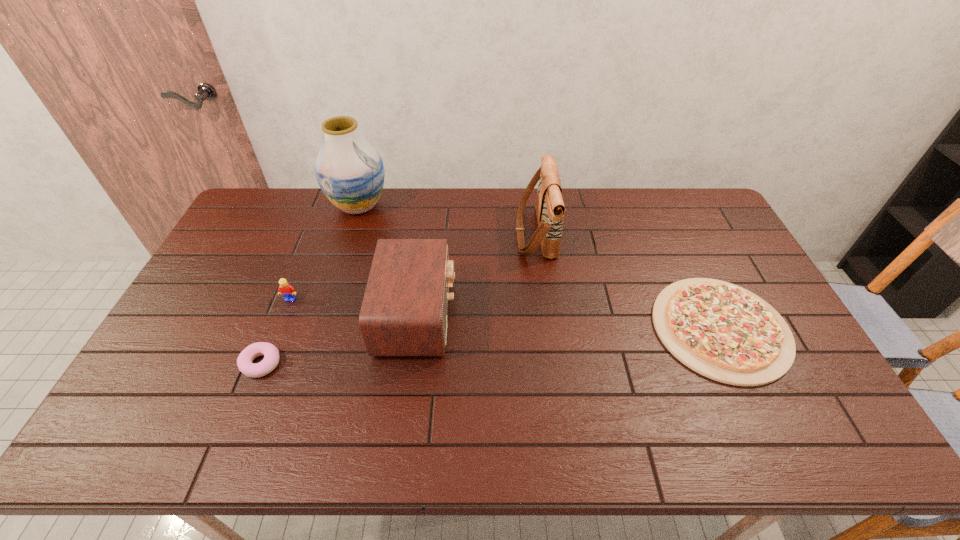
I want to click on free point located on the front-facing side of the second object from right to left, so click(x=475, y=233).

Identify the location of free location located on the front-facing side of the second object from right to left. point(452,233).

Find the location of a particular element. The width and height of the screenshot is (960, 540). free spot located on the front-facing side of the second object from right to left is located at coordinates (449, 233).

Locate an element on the screen. vacant position located 0.270m on the front panel of the fourth shortest object is located at coordinates (547, 315).

Image resolution: width=960 pixels, height=540 pixels. Identify the location of free space located on the front-facing side of the Lego. (275, 341).

Locate an element on the screen. This screenshot has width=960, height=540. free region located on the back of the pastry is located at coordinates (284, 306).

Where is `vacant area located 0.190m on the left of the rightmost object`? Image resolution: width=960 pixels, height=540 pixels. vacant area located 0.190m on the left of the rightmost object is located at coordinates (588, 328).

Where is `vase that is positioned at the far edge`? vase that is positioned at the far edge is located at coordinates (350, 172).

At what (x,y) coordinates should I click in order to perform the action: click on shoulder bag that is at the far edge. Please return your answer as a coordinate pair (x, y). This screenshot has width=960, height=540. Looking at the image, I should click on (549, 205).

This screenshot has height=540, width=960. Find the location of `object positioned at the right edge`. object positioned at the right edge is located at coordinates (722, 331).